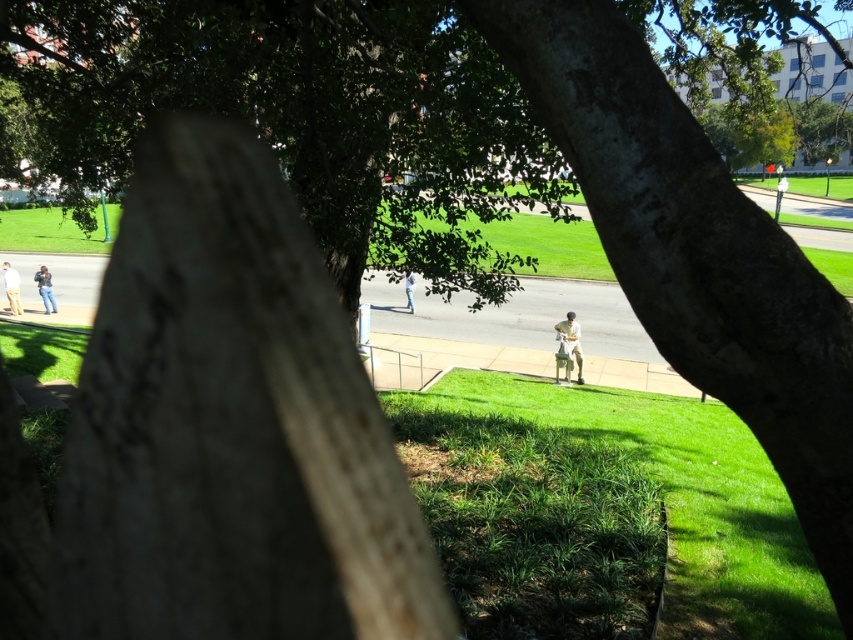
Between light blue jeans at left and light blue shirt at center, which one appears on the left side from the viewer's perspective?

light blue jeans at left is more to the left.

Consider the image. Is light blue jeans at left thinner than light blue shirt at center?

In fact, light blue jeans at left might be wider than light blue shirt at center.

The height and width of the screenshot is (640, 853). What do you see at coordinates (10, 288) in the screenshot?
I see `light blue jeans at left` at bounding box center [10, 288].

Find the location of `light blue jeans at left`. light blue jeans at left is located at coordinates (10, 288).

Consider the image. Who is higher up, khaki cotton pants at center or denim pants at left?

Positioned higher is denim pants at left.

Is khaki cotton pants at center wider than denim pants at left?

In fact, khaki cotton pants at center might be narrower than denim pants at left.

Image resolution: width=853 pixels, height=640 pixels. Describe the element at coordinates (572, 339) in the screenshot. I see `khaki cotton pants at center` at that location.

Locate an element on the screen. The height and width of the screenshot is (640, 853). khaki cotton pants at center is located at coordinates (572, 339).

Between denim pants at left and light blue shirt at center, which one appears on the right side from the viewer's perspective?

light blue shirt at center is more to the right.

The height and width of the screenshot is (640, 853). Describe the element at coordinates (45, 289) in the screenshot. I see `denim pants at left` at that location.

You are a GUI agent. You are given a task and a screenshot of the screen. Output one action in this format:
    pyautogui.click(x=<x>, y=<y>)
    Task: Click on the denim pants at left
    Image resolution: width=853 pixels, height=640 pixels.
    Given the screenshot: What is the action you would take?
    pyautogui.click(x=45, y=289)